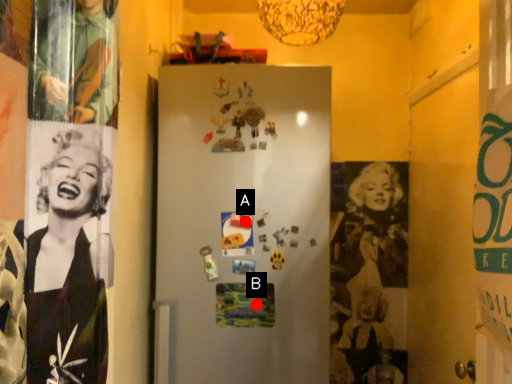
Question: Two points are circled on the image, labeled by A and B beside each circle. Which point is farther to the camera?

Choices:
 (A) A is further
 (B) B is further

Answer: (A)